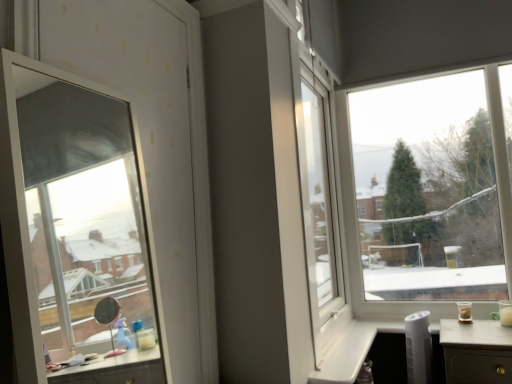
Question: In terms of size, does transparent glass window at upper right, the 1th window when ordered from right to left, appear bigger or smaller than transparent glass window at left, the second window viewed from the back?

Choices:
 (A) small
 (B) big

Answer: (B)

Question: From their relative heights in the image, would you say transparent glass window at upper right, the 1th window when ordered from right to left, is taller or shorter than transparent glass window at left, arranged as the 1th window when viewed from the front?

Choices:
 (A) short
 (B) tall

Answer: (B)

Question: From the image's perspective, is transparent glass window at upper right, the second window positioned from the front, above or below transparent glass window at left, which appears as the 1th window when viewed from the left?

Choices:
 (A) above
 (B) below

Answer: (B)

Question: Considering their positions, is transparent glass window at left, arranged as the 1th window when viewed from the front, located in front of or behind transparent glass window at upper right, which is counted as the second window, starting from the left?

Choices:
 (A) front
 (B) behind

Answer: (A)

Question: Looking at their shapes, would you say transparent glass window at left, the second window viewed from the back, is wider or thinner than transparent glass window at upper right, which is the 1th window from back to front?

Choices:
 (A) thin
 (B) wide

Answer: (A)

Question: From a real-world perspective, is transparent glass window at left, which is counted as the 2th window, starting from the right, above or below transparent glass window at upper right, the 1th window when ordered from right to left?

Choices:
 (A) below
 (B) above

Answer: (B)

Question: Considering the relative positions of transparent glass window at left, arranged as the 1th window when viewed from the front, and transparent glass window at upper right, the second window positioned from the front, in the image provided, is transparent glass window at left, arranged as the 1th window when viewed from the front, to the left or to the right of transparent glass window at upper right, the second window positioned from the front,?

Choices:
 (A) left
 (B) right

Answer: (A)